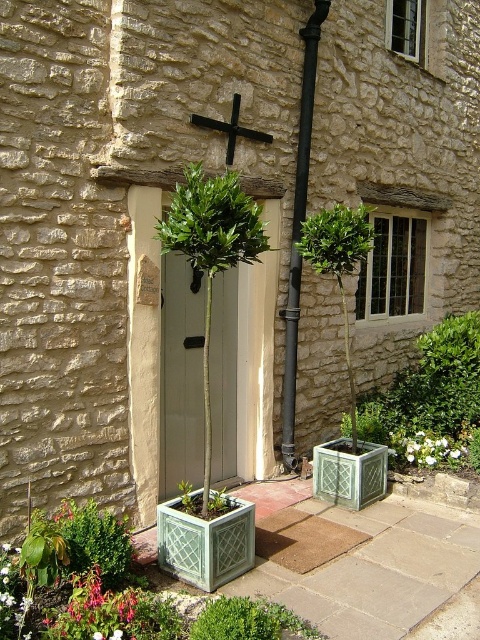
Where is `green lattice planter at lower right`? green lattice planter at lower right is located at coordinates (431, 401).

Looking at this image, is green lattice planter at lower right positioned behind black metal pipe at center?

Yes, green lattice planter at lower right is behind black metal pipe at center.

Is point (448, 452) closer to viewer compared to point (284, 433)?

No, (448, 452) is behind (284, 433).

Where is `green lattice planter at lower right`? green lattice planter at lower right is located at coordinates click(x=431, y=401).

Is white matte door at center to the right of white matte flower at lower left from the viewer's perspective?

Correct, you'll find white matte door at center to the right of white matte flower at lower left.

Between point (218, 339) and point (116, 630), which one is positioned behind?

The point (218, 339) is more distant.

Where is `white matte door at center`? The image size is (480, 640). white matte door at center is located at coordinates (181, 374).

At what (x,y) coordinates should I click in order to perform the action: click on white matte door at center. Please return your answer as a coordinate pair (x, y). This screenshot has width=480, height=640. Looking at the image, I should click on point(181,374).

Is white matte door at center bigger than black metal pipe at center?

Yes.

Which is in front, point (224, 284) or point (315, 20)?

Positioned in front is point (224, 284).

Locate an element on the screen. white matte door at center is located at coordinates (181, 374).